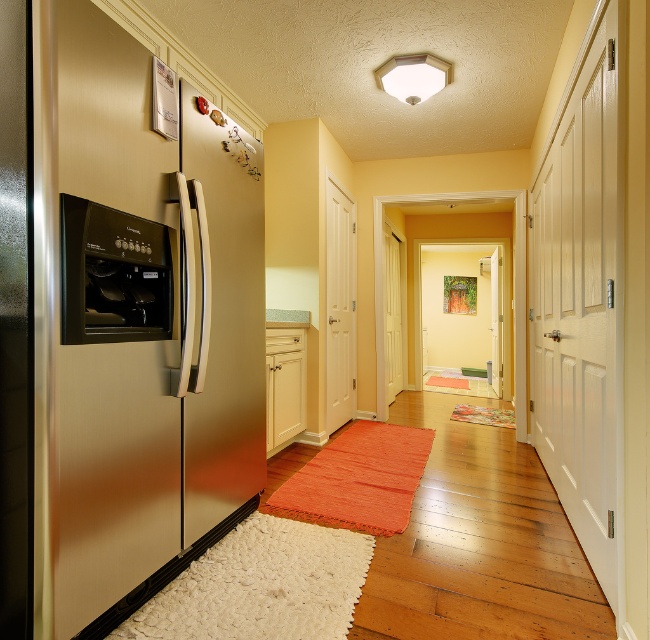
Question: Does stainless steel refrigerator at left appear under satin black oven at left?

Choices:
 (A) yes
 (B) no

Answer: (A)

Question: Can you confirm if stainless steel refrigerator at left is positioned above satin black oven at left?

Choices:
 (A) yes
 (B) no

Answer: (B)

Question: Which point is closer to the camera?

Choices:
 (A) stainless steel refrigerator at left
 (B) satin black oven at left

Answer: (A)

Question: Does stainless steel refrigerator at left appear on the right side of satin black oven at left?

Choices:
 (A) yes
 (B) no

Answer: (A)

Question: Among these points, which one is nearest to the camera?

Choices:
 (A) (83, 332)
 (B) (140, 342)

Answer: (A)